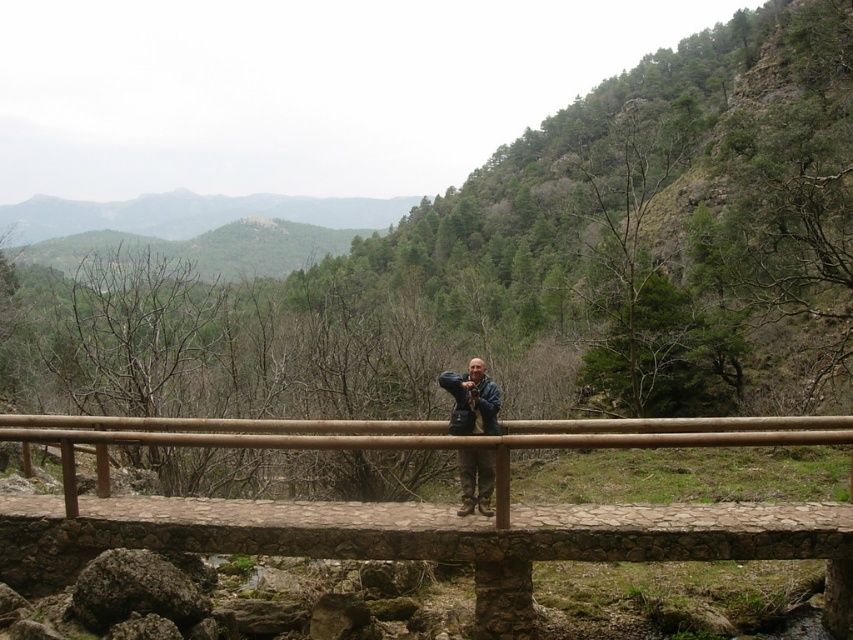
Does point (231, 513) lie behind point (462, 392)?

Yes, point (231, 513) is behind point (462, 392).

How much distance is there between brown wooden bridge at center and blue denim jacket at center?

They are 3.18 meters apart.

Locate an element on the screen. Image resolution: width=853 pixels, height=640 pixels. brown wooden bridge at center is located at coordinates (444, 506).